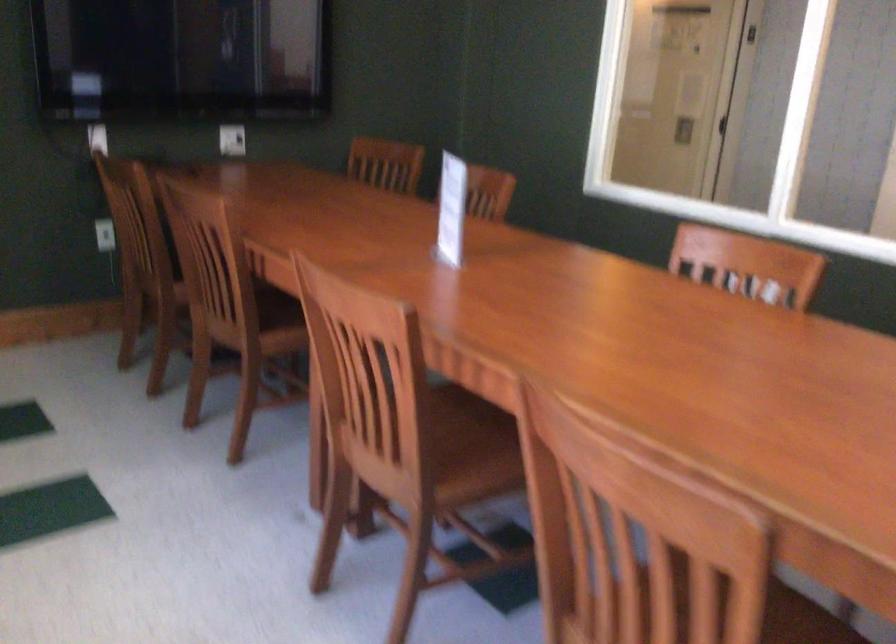
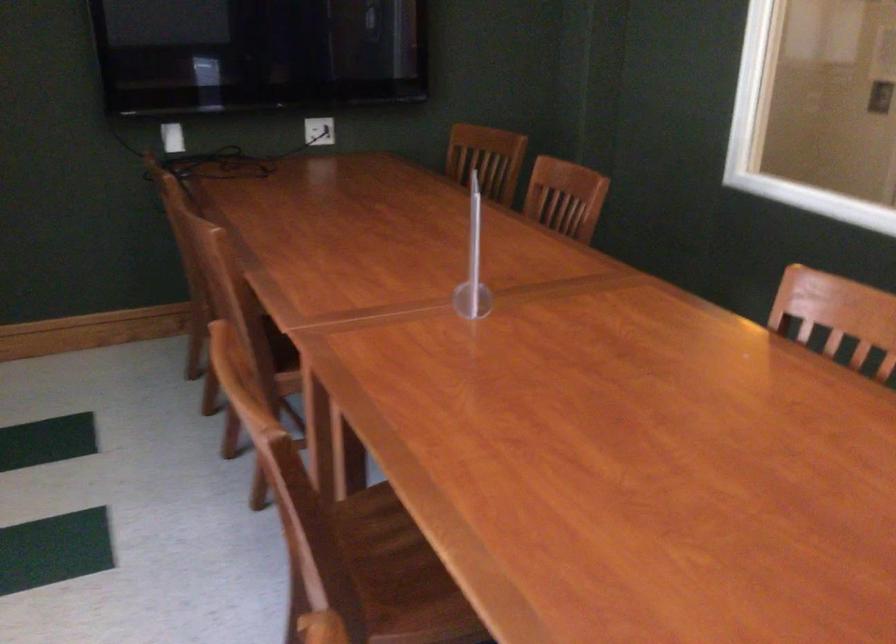
Find the pixel in the second image that matches the point at 225,212 in the first image.

(216, 242)